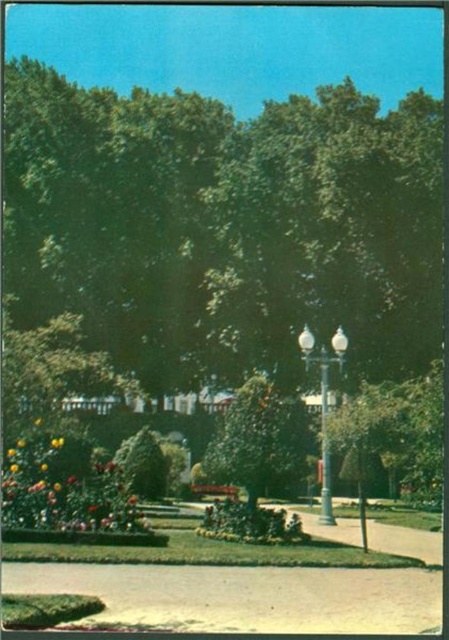
Looking at this image, is green leafy tree at center above glossy yellow flower at center?

Yes, green leafy tree at center is above glossy yellow flower at center.

Measure the distance from green leafy tree at center to glossy yellow flower at center.

A distance of 20.48 meters exists between green leafy tree at center and glossy yellow flower at center.

Consider the image. Who is more distant from viewer, (435,326) or (57,444)?

The point (435,326) is behind.

Where is `green leafy tree at center`? The image size is (449, 640). green leafy tree at center is located at coordinates (224, 225).

Is the position of green leafy bush at center more distant than that of metallic pole at center?

Yes, green leafy bush at center is further from the viewer.

Is green leafy bush at center smaller than metallic pole at center?

No.

Between point (238, 449) and point (328, 508), which one is positioned in front?

Point (238, 449) is more forward.

This screenshot has width=449, height=640. In order to click on green leafy bush at center in this screenshot , I will do `click(259, 440)`.

The height and width of the screenshot is (640, 449). What do you see at coordinates (66, 488) in the screenshot?
I see `glossy floral bouquet at lower left` at bounding box center [66, 488].

Is point (57, 454) positioned in front of point (294, 406)?

Yes.

Which is in front, point (110, 492) or point (262, 451)?

Positioned in front is point (110, 492).

At what (x,y) coordinates should I click in order to perform the action: click on glossy floral bouquet at lower left. Please return your answer as a coordinate pair (x, y). The height and width of the screenshot is (640, 449). Looking at the image, I should click on (66, 488).